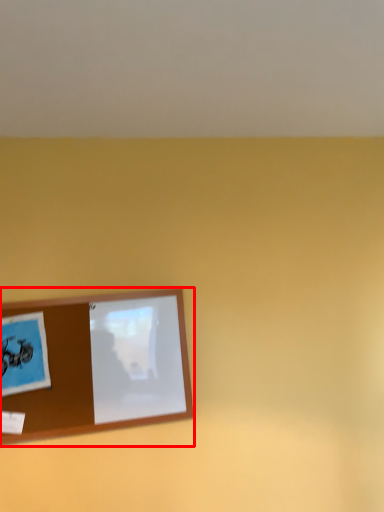
Question: Where is picture frame (annotated by the red box) located in relation to postcard in the image?

Choices:
 (A) right
 (B) left

Answer: (A)